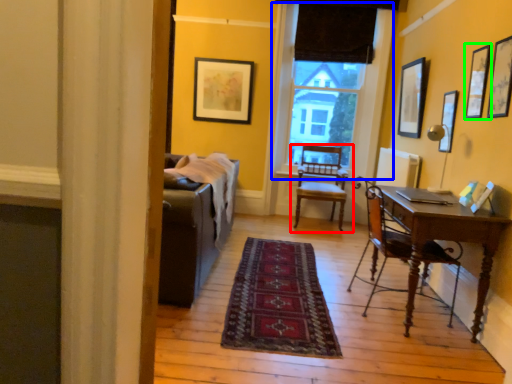
Question: Which is farther away from chair (highlighted by a red box)? window (highlighted by a blue box) or picture frame (highlighted by a green box)?

Choices:
 (A) window
 (B) picture frame

Answer: (B)